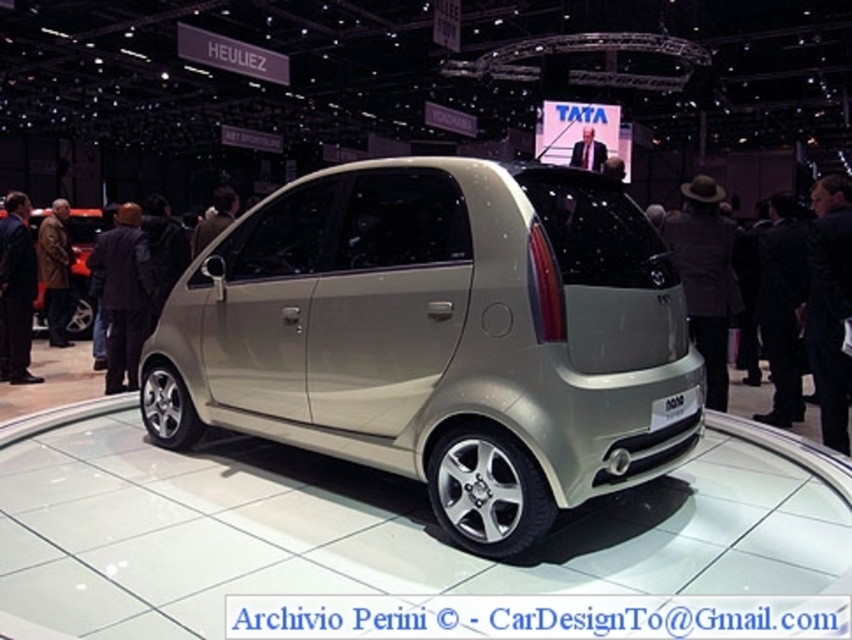
Question: In this image, where is satin beige minivan at center located relative to matte silver car at left?

Choices:
 (A) right
 (B) left

Answer: (A)

Question: Does satin beige minivan at center lie behind matte silver car at left?

Choices:
 (A) yes
 (B) no

Answer: (B)

Question: Which of the following is the closest to the observer?

Choices:
 (A) satin beige minivan at center
 (B) matte silver car at left

Answer: (A)

Question: Is satin beige minivan at center to the right of matte silver car at left from the viewer's perspective?

Choices:
 (A) no
 (B) yes

Answer: (B)

Question: Which object is farther from the camera taking this photo?

Choices:
 (A) satin beige minivan at center
 (B) matte silver car at left

Answer: (B)

Question: Which point appears farthest from the camera in this image?

Choices:
 (A) (75, 234)
 (B) (412, 372)

Answer: (A)